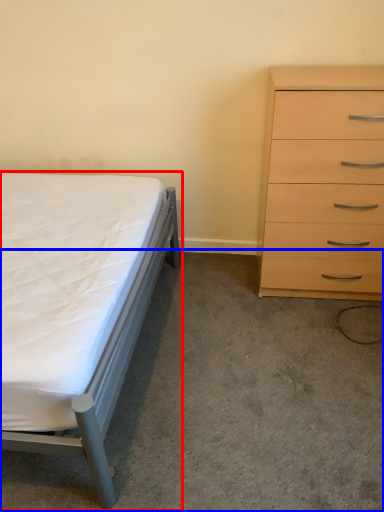
Question: Which object appears farthest to the camera in this image, bed (highlighted by a red box) or concrete (highlighted by a blue box)?

Choices:
 (A) bed
 (B) concrete

Answer: (B)